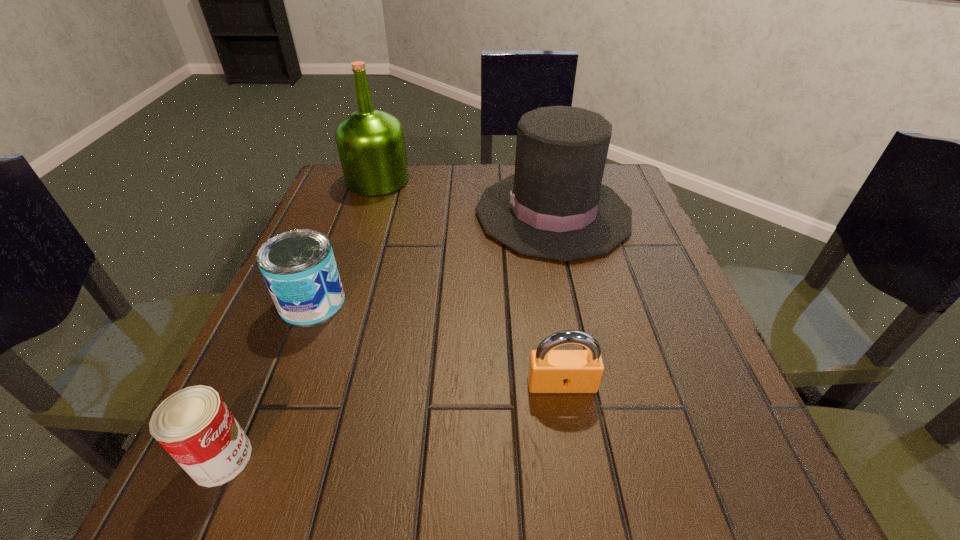
The height and width of the screenshot is (540, 960). What are the coordinates of `vacant space located to unlock the second nearest object from the front` in the screenshot? It's located at (575, 469).

Identify the location of free space located on the front label of the nearest object. The width and height of the screenshot is (960, 540). (397, 458).

I want to click on olive oil that is positioned at the far edge, so click(x=371, y=145).

The image size is (960, 540). What are the coordinates of `dress hat positioned at the far edge` in the screenshot? It's located at (554, 206).

Identify the location of object present at the near edge. (194, 425).

Where is `olive oil positioned at the left edge`? This screenshot has height=540, width=960. olive oil positioned at the left edge is located at coordinates (371, 145).

Image resolution: width=960 pixels, height=540 pixels. I want to click on object at the right edge, so click(x=554, y=206).

Identify the location of object that is at the far left corner. (371, 145).

Locate an element on the screen. object that is positioned at the near left corner is located at coordinates (194, 425).

What are the coordinates of `object present at the far right corner` in the screenshot? It's located at (554, 206).